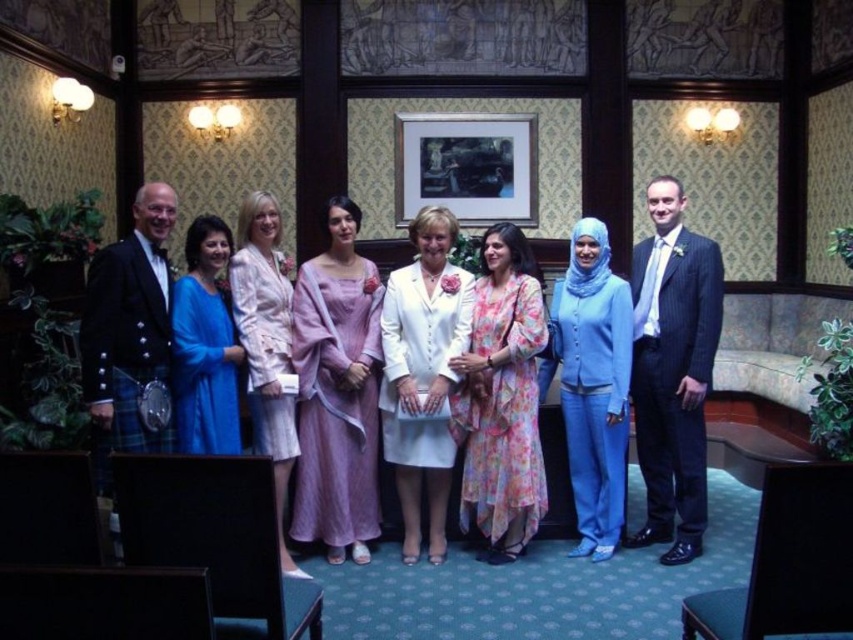
Looking at this image, you are a photographer standing at the camera position. You want to adjust the focus to capture the purple silk dress at center clearly. What is the minimum focusing distance you need to set?

The minimum focusing distance should be set to 4.22 meters to capture the purple silk dress at center clearly.

You are a photographer who wants to ensure all guests are visible in the photo. The dark blue pinstripe suit at right is located at point (672, 369). Is there any part of the dark blue pinstripe suit at right that might be cut off if the photo is cropped to a standard 4x6 aspect ratio?

The dark blue pinstripe suit at right is located at point (672, 369), which is within the standard 4x6 aspect ratio, so no part of it should be cut off.